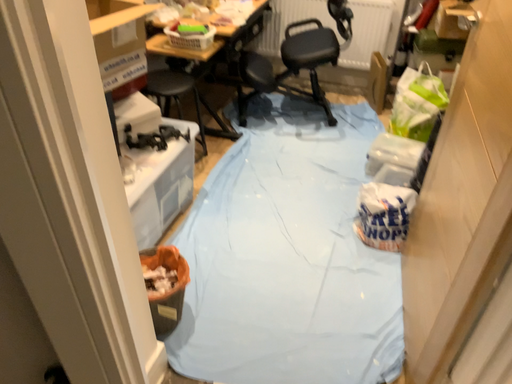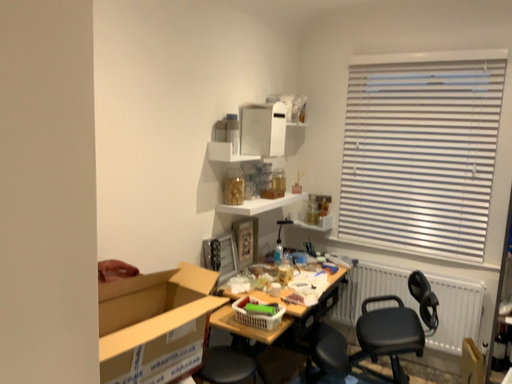
Question: Which way did the camera rotate in the video?

Choices:
 (A) rotated right
 (B) rotated left

Answer: (B)